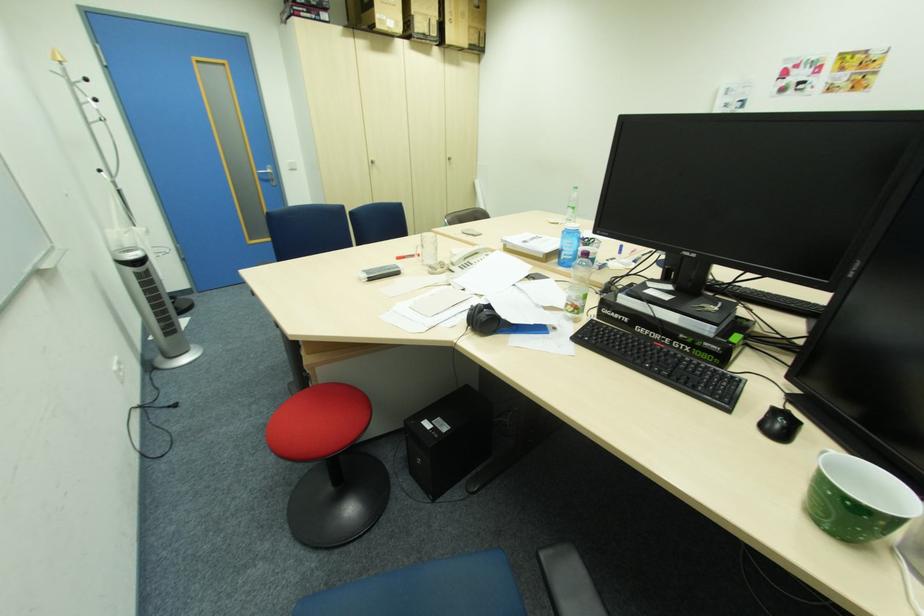
The width and height of the screenshot is (924, 616). I want to click on telephone receiver, so click(x=467, y=257).